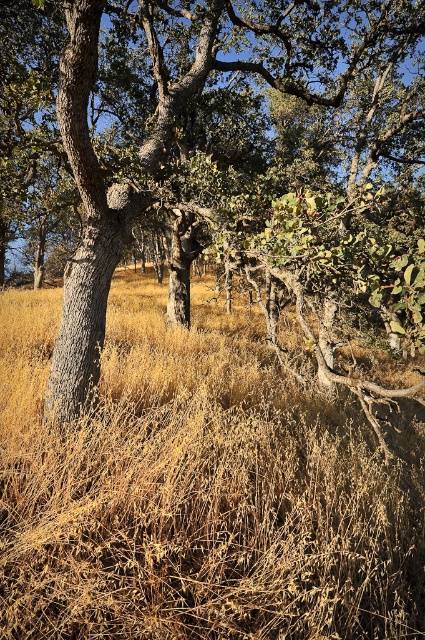
Which of these two, smooth bark tree at center or dry grass at center, stands shorter?

Standing shorter between the two is dry grass at center.

Does smooth bark tree at center appear on the right side of dry grass at center?

Indeed, smooth bark tree at center is positioned on the right side of dry grass at center.

Describe the element at coordinates (221, 156) in the screenshot. I see `smooth bark tree at center` at that location.

Identify the location of smooth bark tree at center. (221, 156).